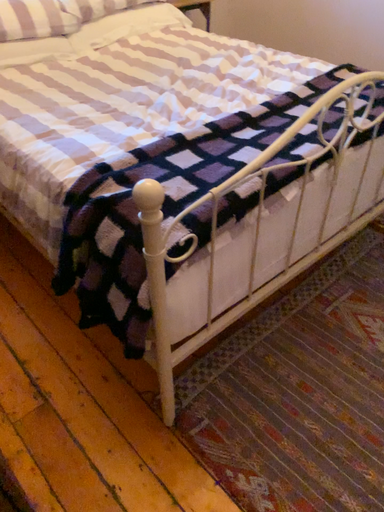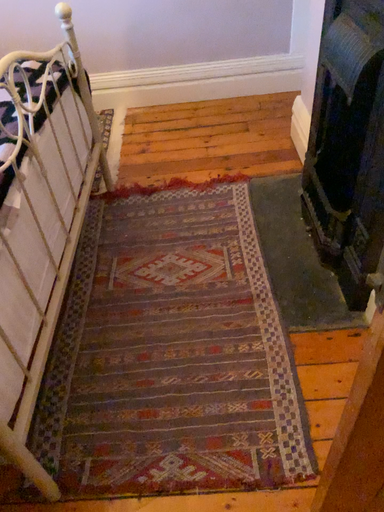
Question: How did the camera likely rotate when shooting the video?

Choices:
 (A) rotated left
 (B) rotated right

Answer: (B)